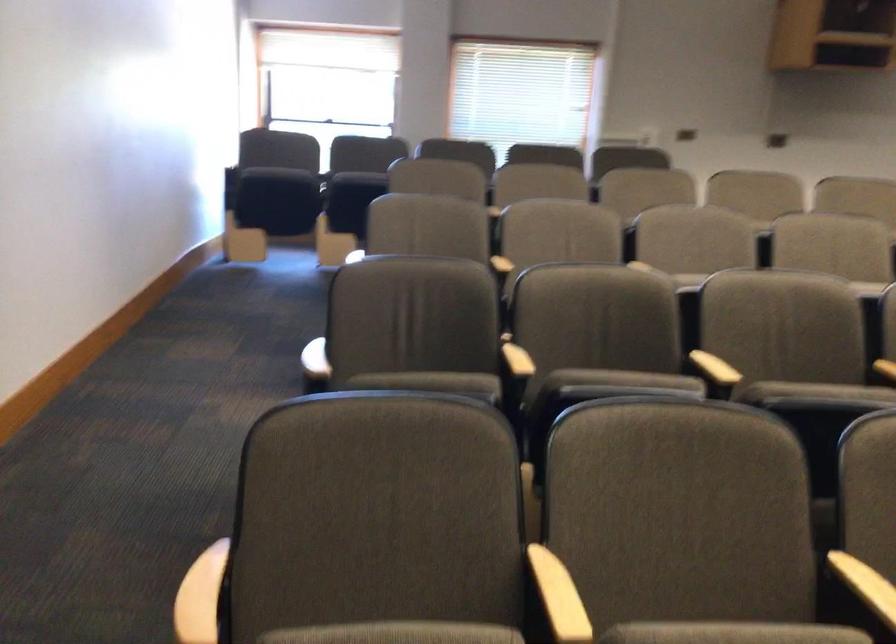
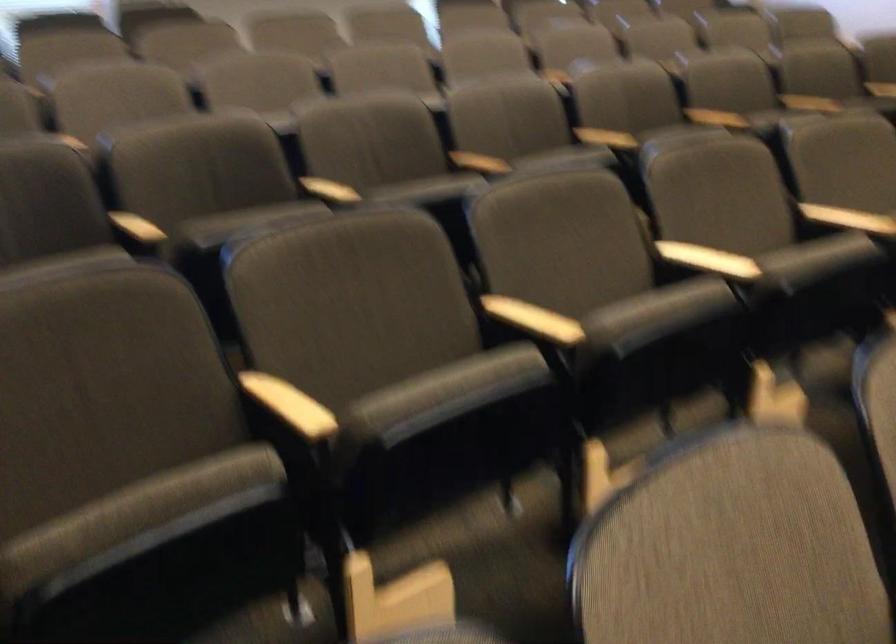
Question: What movement of the cameraman would produce the second image?

Choices:
 (A) Left
 (B) Right
 (C) Forward
 (D) Backward

Answer: (D)